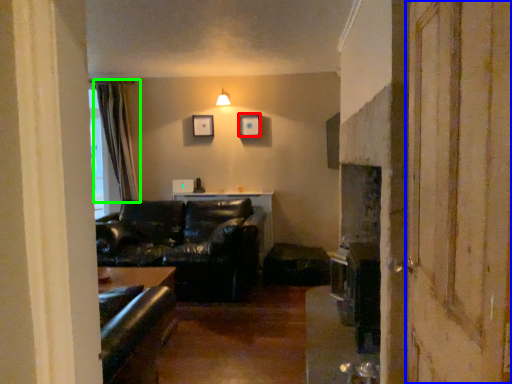
Question: Based on their relative distances, which object is farther from picture frame (highlighted by a red box)? Choose from screen door (highlighted by a blue box) and curtain (highlighted by a green box).

Choices:
 (A) screen door
 (B) curtain

Answer: (A)